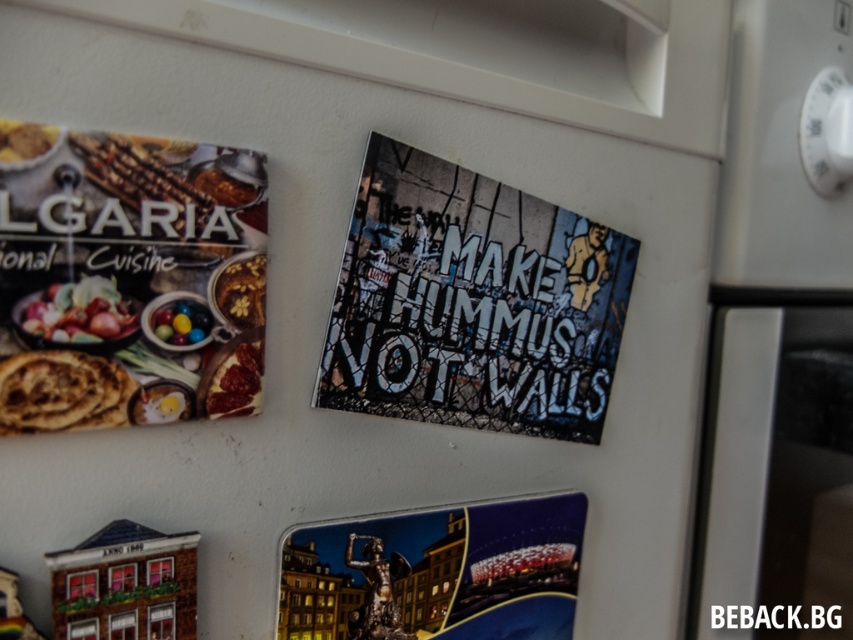
Based on the photo, you are organizing a party and want to place both the metallic poster at center and the shiny multicolored candies at center on the same table. If the table has limited space, which item should you prioritize placing first to ensure both fit?

You should prioritize placing the shiny multicolored candies at center first because the metallic poster at center is wider and will require more space. By placing the smaller item first, you can adjust the larger one around it to fit both on the table.

You are a baker who needs to measure ingredients. You see the brown crumbly bread at left and the shiny metallic bowl at upper left. Which object is taller?

The brown crumbly bread at left is taller than the shiny metallic bowl at upper left according to the description.